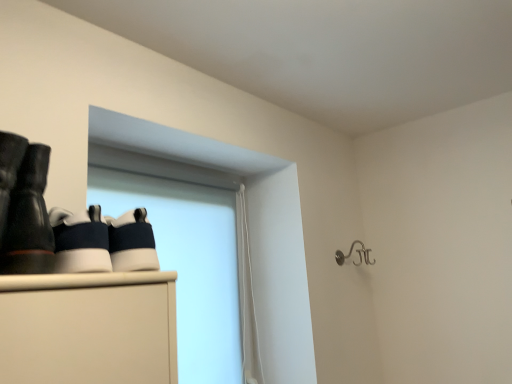
Identify the location of blank space above white matte window screen at upper left (from a real-world perspective). (170, 169).